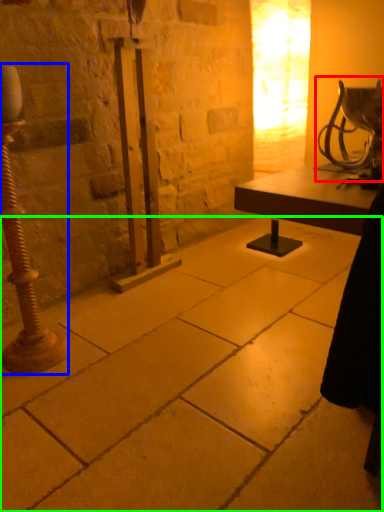
Question: Which object is the closest to the table lamp (highlighted by a red box)? Choose among these: pillar (highlighted by a blue box) or concrete (highlighted by a green box).

Choices:
 (A) pillar
 (B) concrete

Answer: (B)